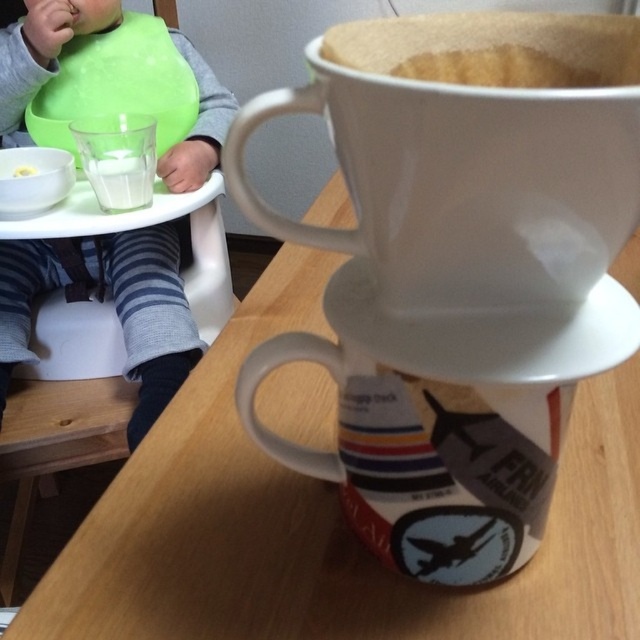
Is white matte mug at upper center to the right of green bibbed baby at left from the viewer's perspective?

Correct, you'll find white matte mug at upper center to the right of green bibbed baby at left.

Based on the photo, is white matte mug at upper center thinner than green bibbed baby at left?

Yes, white matte mug at upper center is thinner than green bibbed baby at left.

Where is `white matte mug at upper center`? The width and height of the screenshot is (640, 640). white matte mug at upper center is located at coordinates (464, 186).

Locate an element on the screen. The image size is (640, 640). white matte mug at upper center is located at coordinates (464, 186).

Can you confirm if white matte mug at upper center is positioned below yellow matte spoon at upper left?

Yes, white matte mug at upper center is below yellow matte spoon at upper left.

Who is positioned more to the right, white matte mug at upper center or yellow matte spoon at upper left?

white matte mug at upper center is more to the right.

Who is more distant from viewer, (544,244) or (26,173)?

The point (26,173) is more distant.

This screenshot has width=640, height=640. I want to click on white matte mug at upper center, so click(x=464, y=186).

Is wooden table at center below white matte saucer at upper center?

No.

Where is `wooden table at center`? wooden table at center is located at coordinates (324, 524).

I want to click on wooden table at center, so click(324, 524).